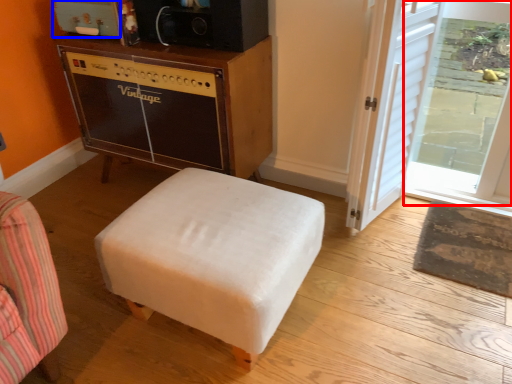
Question: Among these objects, which one is farthest to the camera, glass door (highlighted by a red box) or appliance (highlighted by a blue box)?

Choices:
 (A) glass door
 (B) appliance

Answer: (B)